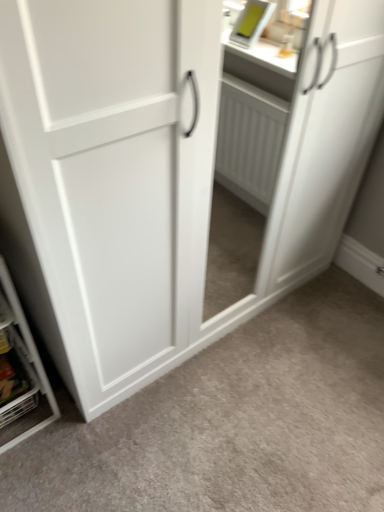
You are a GUI agent. You are given a task and a screenshot of the screen. Output one action in this format:
    pyautogui.click(x=<x>, y=<y>)
    Task: Click on the metallic silver shelf at lower left
    Image resolution: width=384 pixels, height=512 pixels.
    Given the screenshot: What is the action you would take?
    pyautogui.click(x=20, y=368)

The height and width of the screenshot is (512, 384). What do you see at coordinates (20, 368) in the screenshot?
I see `metallic silver shelf at lower left` at bounding box center [20, 368].

Where is `metallic silver shelf at lower left`? The height and width of the screenshot is (512, 384). metallic silver shelf at lower left is located at coordinates (20, 368).